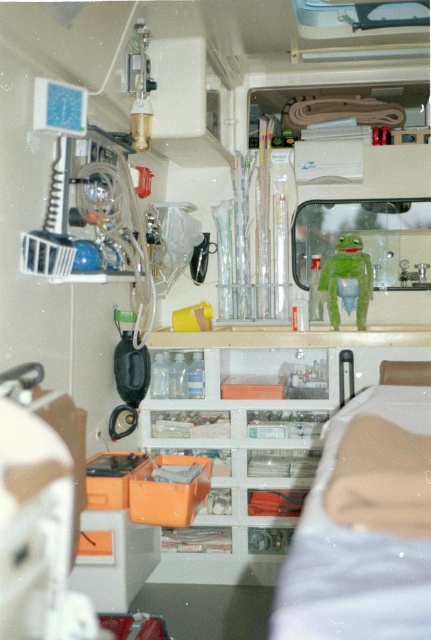
Question: Is clear plastic shelf at center below beige fabric bed at center?

Choices:
 (A) yes
 (B) no

Answer: (A)

Question: Can you confirm if beige fabric bed at center is bigger than green matte kermit the frog at center?

Choices:
 (A) yes
 (B) no

Answer: (A)

Question: Among these objects, which one is nearest to the camera?

Choices:
 (A) clear plastic shelf at center
 (B) beige fabric bed at center

Answer: (B)

Question: Which of these objects is positioned closest to the beige fabric bed at center?

Choices:
 (A) clear plastic shelf at center
 (B) green matte kermit the frog at center

Answer: (B)

Question: Considering the real-world distances, which object is farthest from the beige fabric bed at center?

Choices:
 (A) clear plastic shelf at center
 (B) green matte kermit the frog at center

Answer: (A)

Question: Is beige fabric bed at center to the left of green matte kermit the frog at center from the viewer's perspective?

Choices:
 (A) yes
 (B) no

Answer: (A)